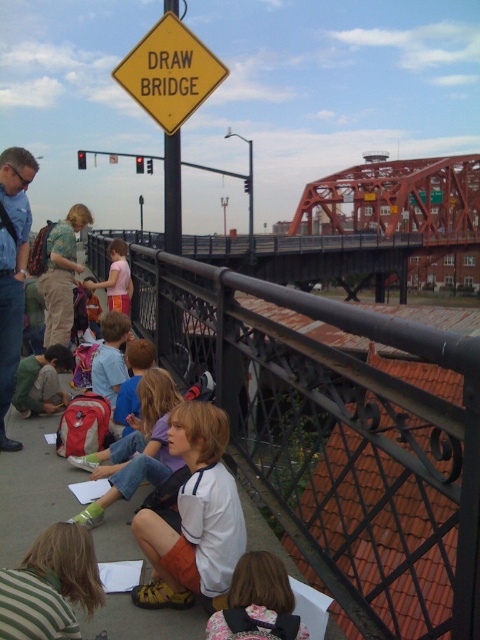
Is yellow plastic signpost at center bigger than pink fabric shirt at center?

Indeed, yellow plastic signpost at center has a larger size compared to pink fabric shirt at center.

In the scene shown: Is yellow plastic signpost at center in front of pink fabric shirt at center?

Yes.

Does point (167, 314) come in front of point (108, 300)?

Yes, point (167, 314) is closer to viewer.

Where is `yellow plastic signpost at center`? The height and width of the screenshot is (640, 480). yellow plastic signpost at center is located at coordinates (171, 193).

Who is more forward, (404, 477) or (386, 188)?

Positioned in front is point (404, 477).

Does black metal railing at center come in front of orange steel bridge at center?

Yes.

Describe the element at coordinates (340, 442) in the screenshot. The image size is (480, 640). I see `black metal railing at center` at that location.

The image size is (480, 640). Find the location of `black metal railing at center`. black metal railing at center is located at coordinates (340, 442).

Does yellow diamond-shaped sign at upper center have a greater width compared to brown fabric backpack at lower center?

Yes, yellow diamond-shaped sign at upper center is wider than brown fabric backpack at lower center.

The width and height of the screenshot is (480, 640). Find the location of `yellow diamond-shaped sign at upper center`. yellow diamond-shaped sign at upper center is located at coordinates (169, 72).

Which is behind, point (196, 83) or point (286, 632)?

Positioned behind is point (196, 83).

In order to click on yellow diamond-shaped sign at upper center in this screenshot , I will do `click(169, 72)`.